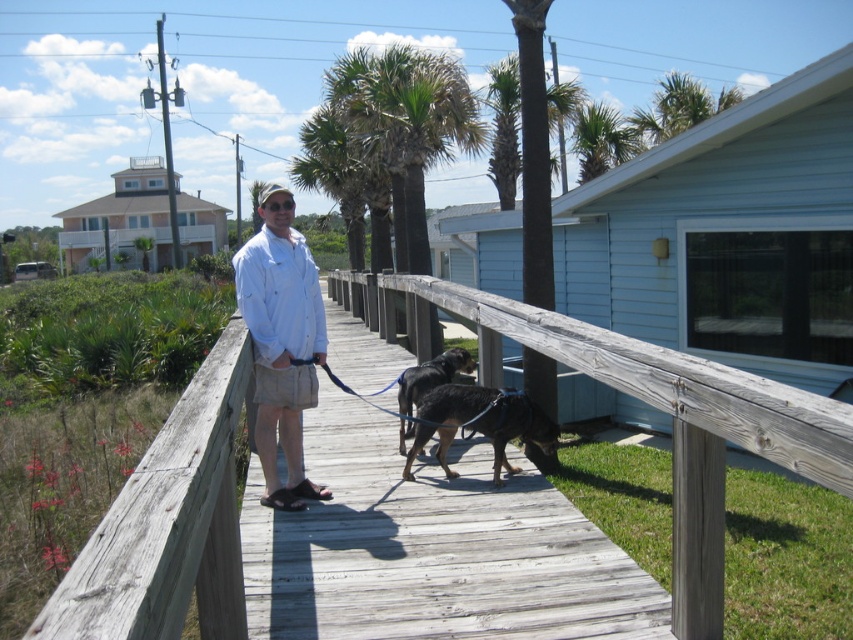
Based on the photo, you are standing on the wooden boardwalk and want to take a photo of the green leafy palm tree at upper center. Which direction should you face to capture it in your view?

The green leafy palm tree at upper center is located at point (599, 140), so you should face towards the upper center direction to capture it in your view.

You are standing on the wooden boardwalk and want to know the exact location of the black fur dog at center. What are its coordinates?

The black fur dog at center is located at coordinates point (x=426, y=385).

You are a photographer trying to capture the man walking two dogs on the boardwalk. You need to ensure the white cotton shirt at center is visible in the frame. Based on its position, where should you position your camera relative to the scene?

The white cotton shirt at center is located at point (280, 333), so you should position your camera to include the center area of the scene to ensure the shirt is visible.